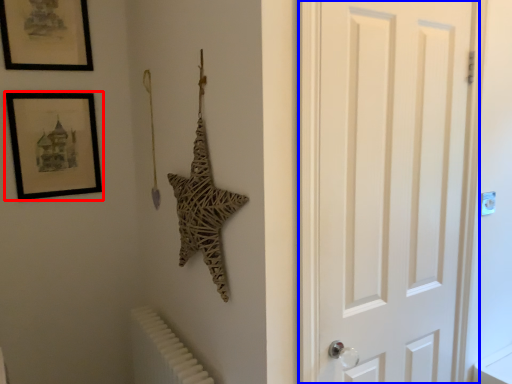
Question: Which of the following is the farthest to the observer, picture frame (highlighted by a red box) or door (highlighted by a blue box)?

Choices:
 (A) picture frame
 (B) door

Answer: (A)